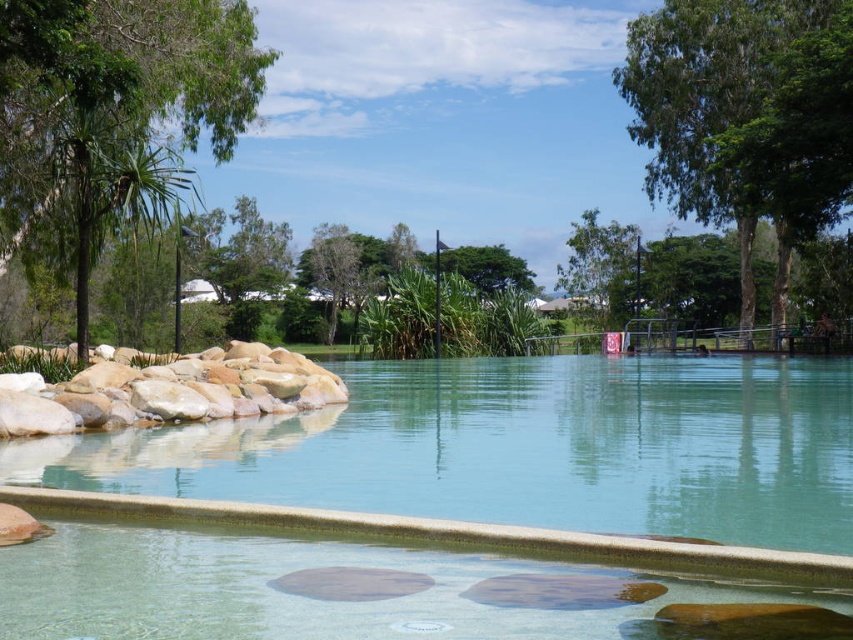
You are planning to install a new bench in the pool area. The bench must be placed between the green leafy tree at right and the green leafy tree at upper center. Considering their widths, which tree should the bench be closer to to ensure it doesn

The green leafy tree at right is wider than the green leafy tree at upper center. To ensure the bench is placed appropriately between them, it should be closer to the narrower tree at upper center to maintain balance.

From the picture: You are standing at the edge of the pool and want to place a small potted plant between the smooth beige rock at left and the green leafy tree at center. Which object should you place it closer to if you want the plant to be in a sunnier spot?

The smooth beige rock at left has a lesser height compared to the green leafy tree at center. Placing the plant closer to the smooth beige rock at left would allow it to receive more sunlight since the tree might cast a shadow over the area near it.

You are standing at the edge of the pool and see two points marked in the scene. The first point is at coordinates point (x=27, y=372) and the second is at point (x=479, y=252). Which point is closer to you?

Point (x=27, y=372) is in front of point (x=479, y=252), so it is closer to you.